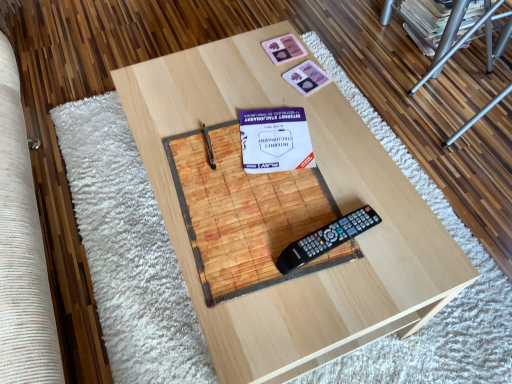
Locate an element on the screen. vacant position to the left of pink matte playing card at upper center, which ranks as the 2th square in top-to-bottom order is located at coordinates (250, 86).